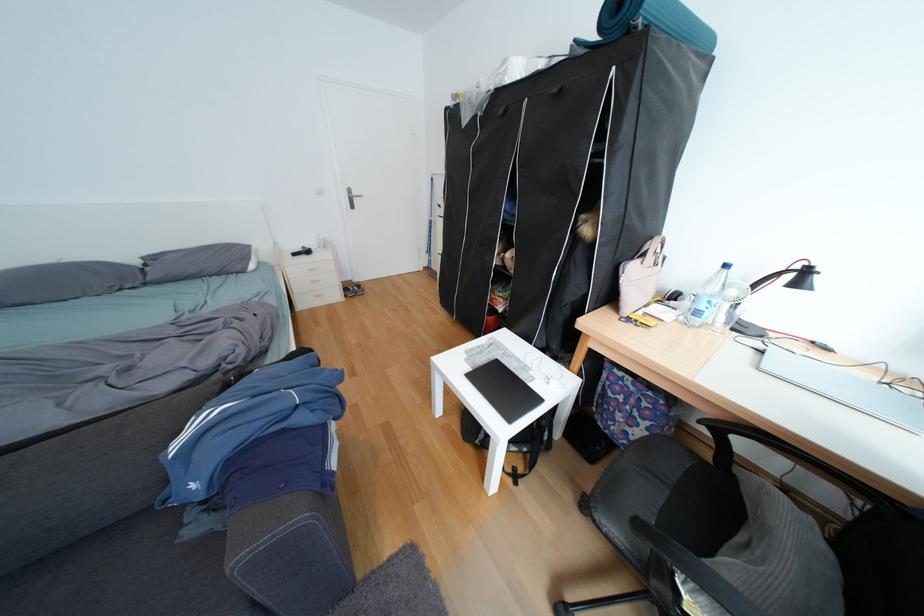
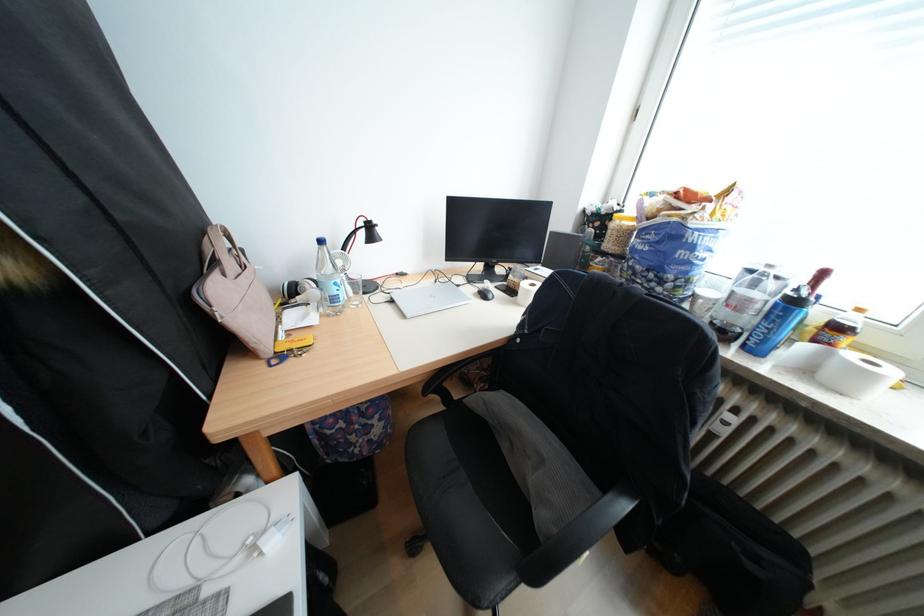
Where in the second image is the point corresponding to (710,314) from the first image?

(346, 300)